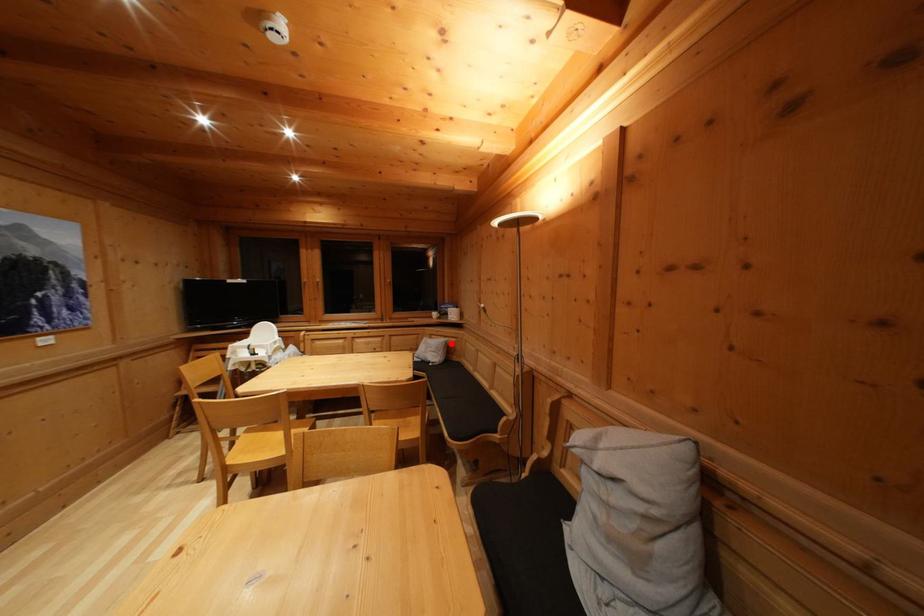
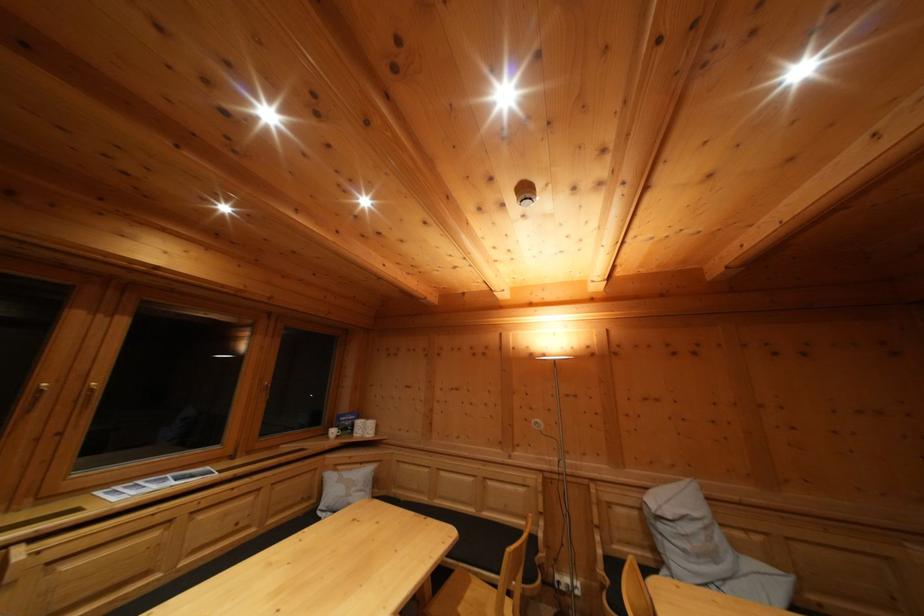
Question: I am providing you with two images of the same scene from different viewpoints. A red point is shown in image1. For the corresponding object point in image2, is it positioned nearer or farther from the camera?

Choices:
 (A) Nearer
 (B) Farther

Answer: (B)